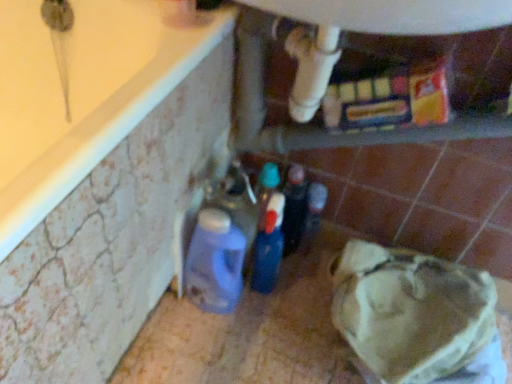
How much space does translucent plastic bottle at center, positioned as the second bottle in left-to-right order, occupy horizontally?

It is 2.65 inches.

Image resolution: width=512 pixels, height=384 pixels. What do you see at coordinates (342, 55) in the screenshot?
I see `white plastic water heater at upper center` at bounding box center [342, 55].

Identify the location of translucent plastic bottle at center, the 1th bottle viewed from the right. (312, 215).

Is matte plastic detergent at lower left, positioned as the 1th bottle in left-to-right order, not close to translucent plastic bottle at center, positioned as the second bottle in left-to-right order?

No, there isn't a large distance between matte plastic detergent at lower left, positioned as the 1th bottle in left-to-right order, and translucent plastic bottle at center, positioned as the second bottle in left-to-right order.

Which object is positioned more to the right, matte plastic detergent at lower left, positioned as the 1th bottle in left-to-right order, or translucent plastic bottle at center, positioned as the second bottle in left-to-right order?

Positioned to the right is translucent plastic bottle at center, positioned as the second bottle in left-to-right order.

Relative to translucent plastic bottle at center, positioned as the second bottle in left-to-right order, is matte plastic detergent at lower left, positioned as the 1th bottle in left-to-right order, in front or behind?

matte plastic detergent at lower left, positioned as the 1th bottle in left-to-right order, is positioned closer to the viewer than translucent plastic bottle at center, positioned as the second bottle in left-to-right order.

Locate an element on the screen. The width and height of the screenshot is (512, 384). bottle on the right of matte plastic detergent at lower left, arranged as the 2th bottle when viewed from the right is located at coordinates (312, 215).

Does white plastic water heater at upper center appear on the right side of matte plastic detergent at lower left, arranged as the 2th bottle when viewed from the right?

Result: Correct, you'll find white plastic water heater at upper center to the right of matte plastic detergent at lower left, arranged as the 2th bottle when viewed from the right.

Which is in front, white plastic water heater at upper center or matte plastic detergent at lower left, arranged as the 2th bottle when viewed from the right?

Positioned in front is white plastic water heater at upper center.

Is white plastic water heater at upper center positioned far away from matte plastic detergent at lower left, arranged as the 2th bottle when viewed from the right?

No, white plastic water heater at upper center is in close proximity to matte plastic detergent at lower left, arranged as the 2th bottle when viewed from the right.

Is translucent plastic bottle at center, the 1th bottle viewed from the right, not close to white plastic water heater at upper center?

translucent plastic bottle at center, the 1th bottle viewed from the right, is actually quite close to white plastic water heater at upper center.

Is translucent plastic bottle at center, the 1th bottle viewed from the right, spatially inside white plastic water heater at upper center, or outside of it?

translucent plastic bottle at center, the 1th bottle viewed from the right, lies outside white plastic water heater at upper center.

Identify the location of water heater to the right of translucent plastic bottle at center, the 1th bottle viewed from the right. (342, 55).

Is translucent plastic bottle at center, the 1th bottle viewed from the right, taller than matte plastic detergent at lower left, arranged as the 2th bottle when viewed from the right?

In fact, translucent plastic bottle at center, the 1th bottle viewed from the right, may be shorter than matte plastic detergent at lower left, arranged as the 2th bottle when viewed from the right.

Is translucent plastic bottle at center, the 1th bottle viewed from the right, oriented away from matte plastic detergent at lower left, positioned as the 1th bottle in left-to-right order?

No.

Can you see translucent plastic bottle at center, the 1th bottle viewed from the right, touching matte plastic detergent at lower left, positioned as the 1th bottle in left-to-right order?

No, translucent plastic bottle at center, the 1th bottle viewed from the right, is not making contact with matte plastic detergent at lower left, positioned as the 1th bottle in left-to-right order.

In the scene shown: Can you confirm if white plastic water heater at upper center is taller than translucent plastic bottle at center, the 1th bottle viewed from the right?

Indeed, white plastic water heater at upper center has a greater height compared to translucent plastic bottle at center, the 1th bottle viewed from the right.

Considering the sizes of objects white plastic water heater at upper center and translucent plastic bottle at center, the 1th bottle viewed from the right, in the image provided, who is thinner, white plastic water heater at upper center or translucent plastic bottle at center, the 1th bottle viewed from the right,?

Thinner between the two is translucent plastic bottle at center, the 1th bottle viewed from the right.

Find the location of a particular element. water heater above the translucent plastic bottle at center, positioned as the second bottle in left-to-right order (from a real-world perspective) is located at coordinates (342, 55).

Are matte plastic detergent at lower left, positioned as the 1th bottle in left-to-right order, and white plastic water heater at upper center located far from each other?

No, matte plastic detergent at lower left, positioned as the 1th bottle in left-to-right order, is in close proximity to white plastic water heater at upper center.

Which object is positioned more to the left, matte plastic detergent at lower left, arranged as the 2th bottle when viewed from the right, or white plastic water heater at upper center?

matte plastic detergent at lower left, arranged as the 2th bottle when viewed from the right, is more to the left.

Is matte plastic detergent at lower left, positioned as the 1th bottle in left-to-right order, smaller than white plastic water heater at upper center?

Indeed, matte plastic detergent at lower left, positioned as the 1th bottle in left-to-right order, has a smaller size compared to white plastic water heater at upper center.

Does matte plastic detergent at lower left, positioned as the 1th bottle in left-to-right order, have a lesser width compared to white plastic water heater at upper center?

Correct, the width of matte plastic detergent at lower left, positioned as the 1th bottle in left-to-right order, is less than that of white plastic water heater at upper center.

Where is `bottle on the left of translucent plastic bottle at center, the 1th bottle viewed from the right`? This screenshot has height=384, width=512. bottle on the left of translucent plastic bottle at center, the 1th bottle viewed from the right is located at coordinates (215, 263).

From the white plastic water heater at upper center, count 1st bottles backward and point to it. Please provide its 2D coordinates.

[(215, 263)]

Estimate the real-world distances between objects in this image. Which object is closer to translucent plastic bottle at center, the 1th bottle viewed from the right, matte plastic detergent at lower left, arranged as the 2th bottle when viewed from the right, or white plastic water heater at upper center?

Among the two, matte plastic detergent at lower left, arranged as the 2th bottle when viewed from the right, is located nearer to translucent plastic bottle at center, the 1th bottle viewed from the right.

Estimate the real-world distances between objects in this image. Which object is further from translucent plastic bottle at center, positioned as the second bottle in left-to-right order, white plastic water heater at upper center or matte plastic detergent at lower left, arranged as the 2th bottle when viewed from the right?

white plastic water heater at upper center is further to translucent plastic bottle at center, positioned as the second bottle in left-to-right order.

Estimate the real-world distances between objects in this image. Which object is closer to white plastic water heater at upper center, translucent plastic bottle at center, positioned as the second bottle in left-to-right order, or matte plastic detergent at lower left, positioned as the 1th bottle in left-to-right order?

Among the two, translucent plastic bottle at center, positioned as the second bottle in left-to-right order, is located nearer to white plastic water heater at upper center.

Based on their spatial positions, is matte plastic detergent at lower left, arranged as the 2th bottle when viewed from the right, or translucent plastic bottle at center, positioned as the second bottle in left-to-right order, closer to white plastic water heater at upper center?

Based on the image, translucent plastic bottle at center, positioned as the second bottle in left-to-right order, appears to be nearer to white plastic water heater at upper center.

Which object lies nearer to the anchor point matte plastic detergent at lower left, positioned as the 1th bottle in left-to-right order, translucent plastic bottle at center, positioned as the second bottle in left-to-right order, or white plastic water heater at upper center?

Based on the image, translucent plastic bottle at center, positioned as the second bottle in left-to-right order, appears to be nearer to matte plastic detergent at lower left, positioned as the 1th bottle in left-to-right order.

Estimate the real-world distances between objects in this image. Which object is further from matte plastic detergent at lower left, positioned as the 1th bottle in left-to-right order, white plastic water heater at upper center or translucent plastic bottle at center, the 1th bottle viewed from the right?

The object further to matte plastic detergent at lower left, positioned as the 1th bottle in left-to-right order, is white plastic water heater at upper center.

Where is `bottle between white plastic water heater at upper center and matte plastic detergent at lower left, positioned as the 1th bottle in left-to-right order, vertically`? This screenshot has height=384, width=512. bottle between white plastic water heater at upper center and matte plastic detergent at lower left, positioned as the 1th bottle in left-to-right order, vertically is located at coordinates (312, 215).